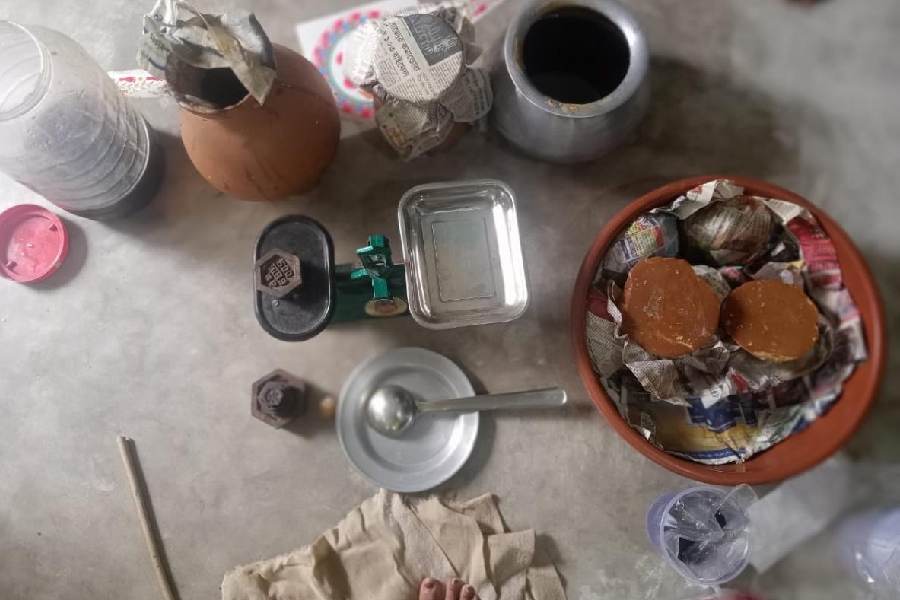
Where is `light brown or beige rag`? light brown or beige rag is located at coordinates (392, 570).